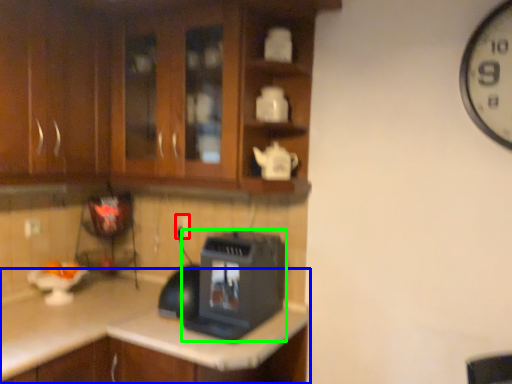
Question: Which object is positioned closest to electric outlet (highlighted by a red box)? Select from countertop (highlighted by a blue box) and home appliance (highlighted by a green box).

Choices:
 (A) countertop
 (B) home appliance

Answer: (B)